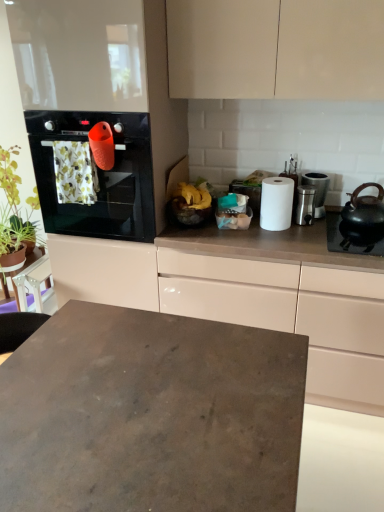
Question: Is green leafy plant at left far from yellow matte bananas at center?

Choices:
 (A) no
 (B) yes

Answer: (B)

Question: Considering the relative positions of green leafy plant at left and yellow matte bananas at center in the image provided, is green leafy plant at left to the left of yellow matte bananas at center from the viewer's perspective?

Choices:
 (A) yes
 (B) no

Answer: (A)

Question: From the image's perspective, is green leafy plant at left located beneath yellow matte bananas at center?

Choices:
 (A) yes
 (B) no

Answer: (B)

Question: Is green leafy plant at left turned away from yellow matte bananas at center?

Choices:
 (A) yes
 (B) no

Answer: (B)

Question: Does green leafy plant at left appear on the right side of yellow matte bananas at center?

Choices:
 (A) no
 (B) yes

Answer: (A)

Question: Does point (357, 329) appear closer or farther from the camera than point (321, 206)?

Choices:
 (A) farther
 (B) closer

Answer: (B)

Question: Is white glossy cabinet at upper right bigger or smaller than satin silver canister at right, the 2th appliance when ordered from left to right?

Choices:
 (A) big
 (B) small

Answer: (A)

Question: Is white glossy cabinet at upper right inside or outside of satin silver canister at right, the 2th appliance when ordered from left to right?

Choices:
 (A) outside
 (B) inside

Answer: (A)

Question: Is white glossy cabinet at upper right in front of or behind satin silver canister at right, which is the 1th appliance from right to left, in the image?

Choices:
 (A) behind
 (B) front

Answer: (B)

Question: Considering the relative positions of black matte gas stove at right and white matte paper towel at center in the image provided, is black matte gas stove at right to the left or to the right of white matte paper towel at center?

Choices:
 (A) right
 (B) left

Answer: (A)

Question: Choose the correct answer: Is black matte gas stove at right inside white matte paper towel at center or outside it?

Choices:
 (A) inside
 (B) outside

Answer: (B)

Question: From the image's perspective, is black matte gas stove at right above or below white matte paper towel at center?

Choices:
 (A) above
 (B) below

Answer: (B)

Question: Relative to white matte paper towel at center, is black matte gas stove at right in front or behind?

Choices:
 (A) behind
 (B) front

Answer: (B)

Question: From the image's perspective, is satin silver canister at right, the 2th appliance when ordered from left to right, above or below black matte gas stove at right?

Choices:
 (A) below
 (B) above

Answer: (B)

Question: From a real-world perspective, is satin silver canister at right, which is the 1th appliance from right to left, above or below black matte gas stove at right?

Choices:
 (A) above
 (B) below

Answer: (A)